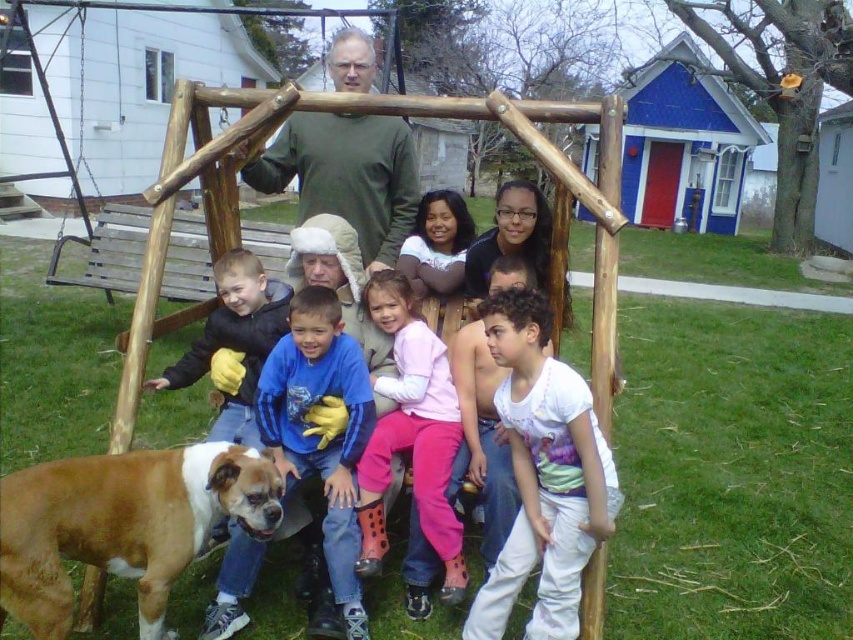
You are planning to place a new bench next to the blue fleece jacket at center and the wooden swing set at center. Which object requires a smaller bench width to accommodate its side?

The blue fleece jacket at center requires a smaller bench width because its width is less than the wooden swing set at center.

Consider the image. You are standing in the backyard looking at the wooden swing set at center and the blue fleece jacket at center. Which object is closer to you?

The blue fleece jacket at center is closer to you because it is in front of the wooden swing set at center.

You are standing in the backyard looking at the swing set. You want to pick up the blue fleece jacket at center. Is it within your reach without moving your feet?

The blue fleece jacket at center is 2.17 meters away from viewer, so it is out of reach without moving closer.